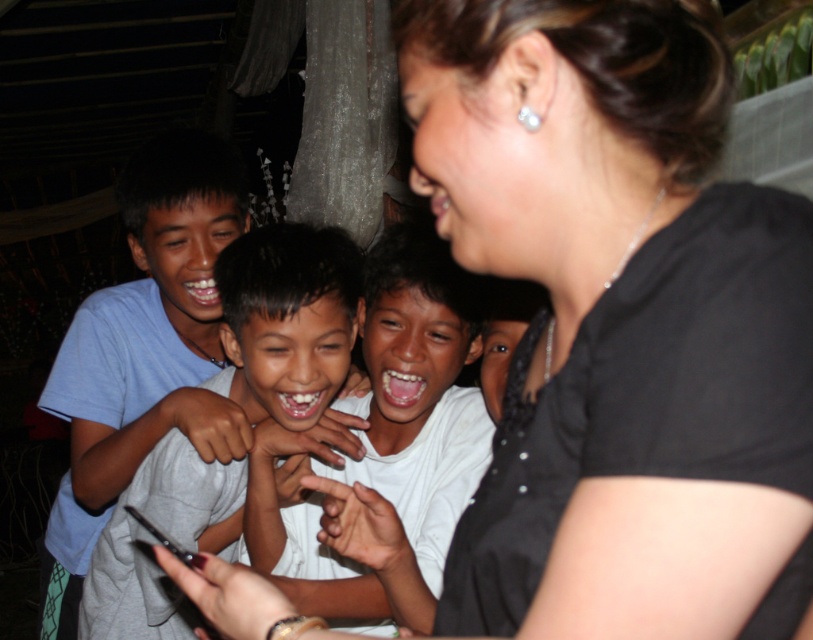
Can you confirm if light blue t-shirt at left is thinner than gray matte shirt at center?

Incorrect, light blue t-shirt at left's width is not less than gray matte shirt at center's.

This screenshot has height=640, width=813. Describe the element at coordinates (142, 349) in the screenshot. I see `light blue t-shirt at left` at that location.

Which is in front, point (216, 138) or point (146, 602)?

Point (146, 602) is more forward.

Find the location of a particular element. Image resolution: width=813 pixels, height=640 pixels. light blue t-shirt at left is located at coordinates (142, 349).

Does point (425, 416) lie in front of point (303, 404)?

No, (425, 416) is behind (303, 404).

Is point (403, 328) positioned after point (141, 612)?

No, (403, 328) is in front of (141, 612).

Where is `smooth white shirt at center`? The image size is (813, 640). smooth white shirt at center is located at coordinates (418, 392).

Does point (62, 577) come behind point (438, 420)?

Yes, point (62, 577) is farther from viewer.

Locate an element on the screen. light blue t-shirt at left is located at coordinates (142, 349).